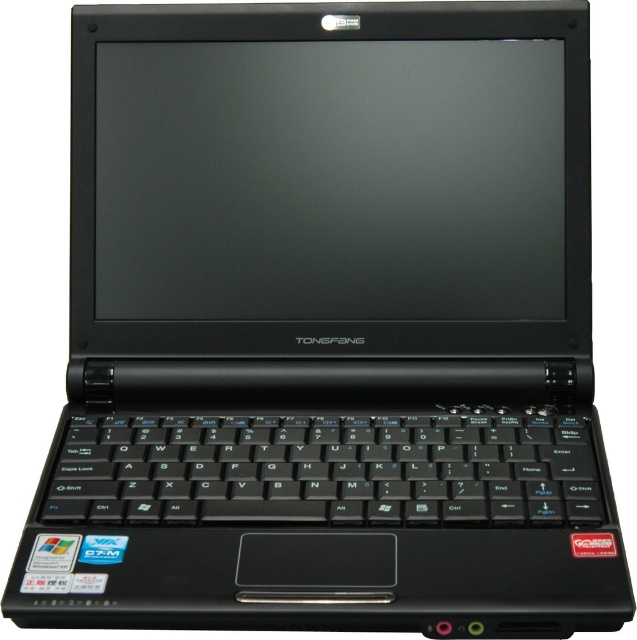
You are setting up a new laptop and need to ensure the screen and keyboard are positioned correctly. Based on the image, which object is taller between the black matte screen at center and the black plastic keyboard at center?

The black matte screen at center is taller than the black plastic keyboard at center according to the description.

You are trying to locate the black matte screen at center on the laptop. According to the coordinates provided, where exactly would you find it?

The black matte screen at center is located at point coordinates of 0.283 on the x axis and 0.518 on the y axis.